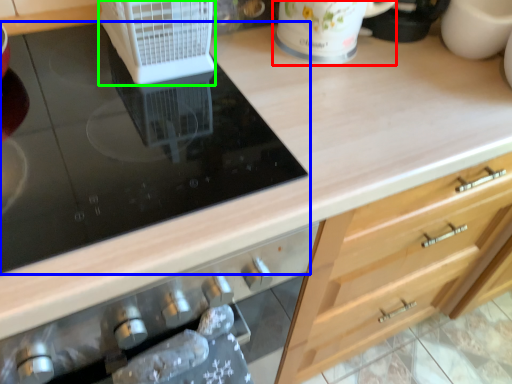
Question: Which is farther away from mug (highlighted by a red box)? gas stove (highlighted by a blue box) or kitchen appliance (highlighted by a green box)?

Choices:
 (A) gas stove
 (B) kitchen appliance

Answer: (A)